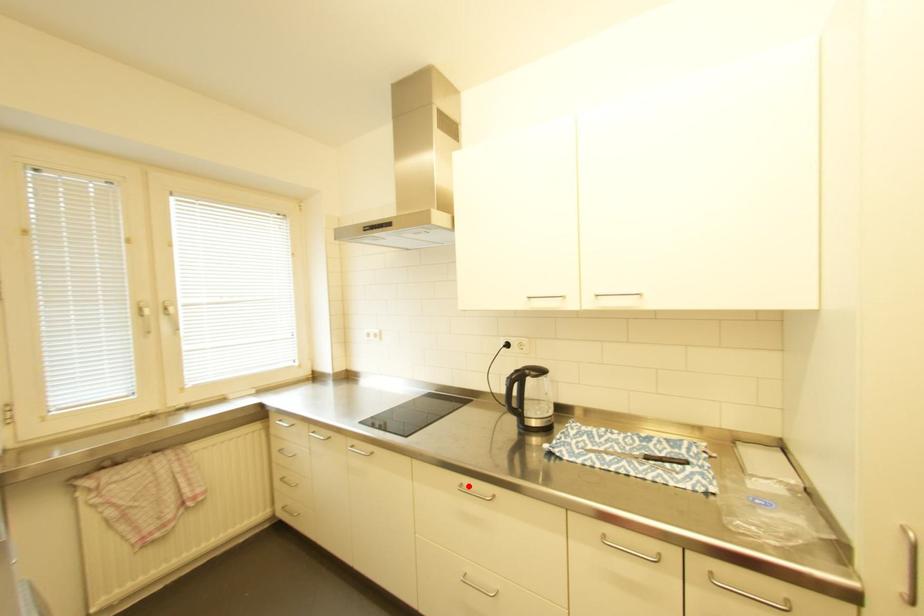
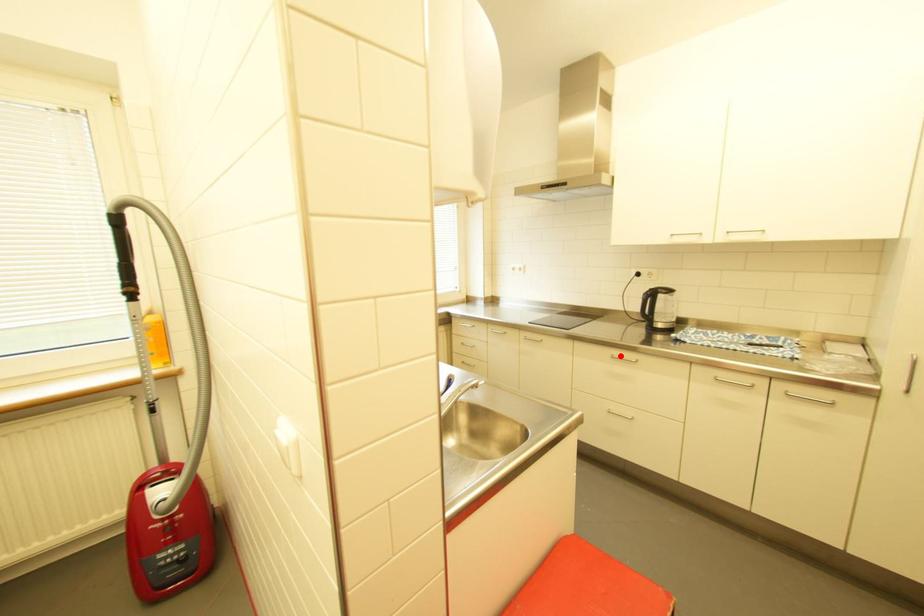
I am providing you with two images of the same scene from different viewpoints. A red point is marked on the first image and another point is marked on the second image. Is the marked point in image1 the same physical position as the marked point in image2?

Yes